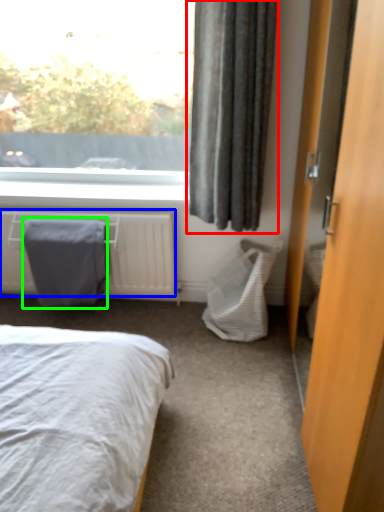
Question: Which object is positioned closest to curtain (highlighted by a red box)? Select from radiator (highlighted by a blue box) and blanket (highlighted by a green box).

Choices:
 (A) radiator
 (B) blanket

Answer: (A)